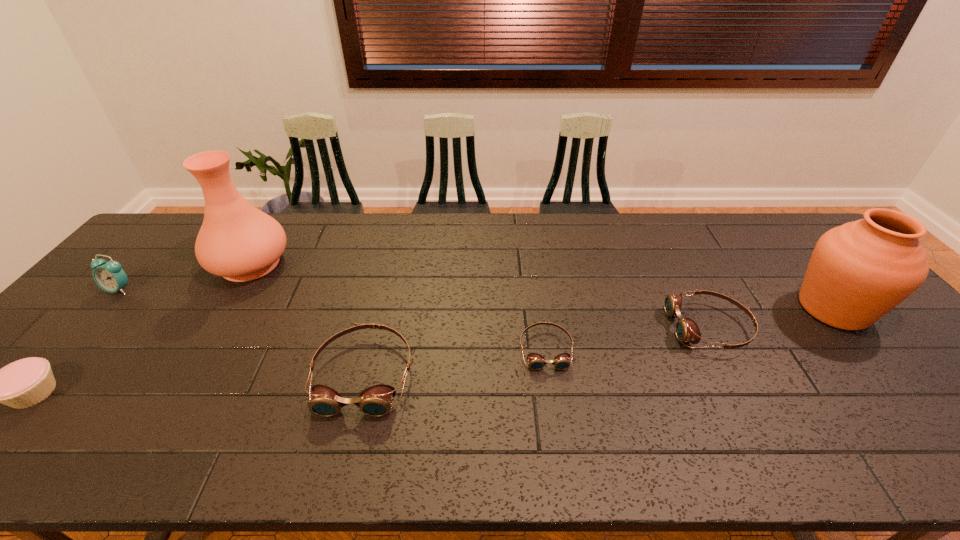
Locate an element on the screen. The height and width of the screenshot is (540, 960). the leftmost goggles is located at coordinates (375, 401).

Where is `the second goggles from left to right`? This screenshot has height=540, width=960. the second goggles from left to right is located at coordinates (536, 361).

At what (x,y) coordinates should I click in order to perform the action: click on the shortest goggles. Please return your answer as a coordinate pair (x, y). Image resolution: width=960 pixels, height=540 pixels. Looking at the image, I should click on (536, 361).

Locate an element on the screen. the rightmost goggles is located at coordinates (686, 329).

At what (x,y) coordinates should I click in order to perform the action: click on the second tallest goggles. Please return your answer as a coordinate pair (x, y). This screenshot has width=960, height=540. Looking at the image, I should click on point(686,329).

Find the location of a particular element. the third object from left to right is located at coordinates (236, 241).

You are a GUI agent. You are given a task and a screenshot of the screen. Output one action in this format:
    pyautogui.click(x=<x>, y=<y>)
    Task: Click on the tallest object
    The height and width of the screenshot is (540, 960).
    Given the screenshot: What is the action you would take?
    pyautogui.click(x=236, y=241)

You are a GUI agent. You are given a task and a screenshot of the screen. Output one action in this format:
    pyautogui.click(x=<x>, y=<y>)
    Task: Click on the third tallest object
    The height and width of the screenshot is (540, 960).
    Given the screenshot: What is the action you would take?
    pyautogui.click(x=110, y=276)

Find the location of a particular element. The height and width of the screenshot is (540, 960). urn is located at coordinates click(858, 272).

Identify the location of the second tallest object. (858, 272).